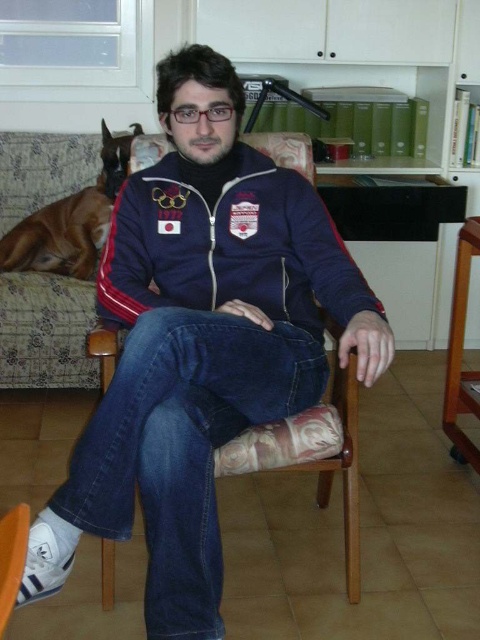
Is navy blue zip-up jacket at center smaller than brown fur dog at upper left?

Actually, navy blue zip-up jacket at center might be larger than brown fur dog at upper left.

Which is in front, point (142, 480) or point (19, 266)?

Point (142, 480)

What are the coordinates of `navy blue zip-up jacket at center` in the screenshot? It's located at (201, 342).

Does navy blue fleece sweatshirt at center have a lesser height compared to brown fur dog at upper left?

Yes, navy blue fleece sweatshirt at center is shorter than brown fur dog at upper left.

Between point (168, 198) and point (27, 221), which one is positioned behind?

The point (27, 221) is behind.

The image size is (480, 640). In order to click on navy blue fleece sweatshirt at center in this screenshot , I will do `click(228, 244)`.

Is navy blue zip-up jacket at center smaller than navy blue fleece sweatshirt at center?

No, navy blue zip-up jacket at center is not smaller than navy blue fleece sweatshirt at center.

Which is in front, point (262, 273) or point (362, 280)?

Point (362, 280)

Find the location of `navy blue zip-up jacket at center`. navy blue zip-up jacket at center is located at coordinates (201, 342).